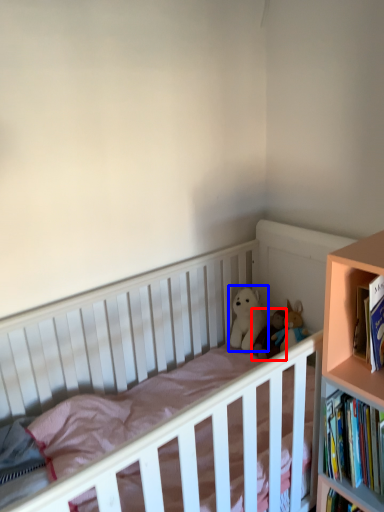
Question: Among these objects, which one is farthest to the camera, doll (highlighted by a red box) or doll (highlighted by a blue box)?

Choices:
 (A) doll
 (B) doll

Answer: (B)